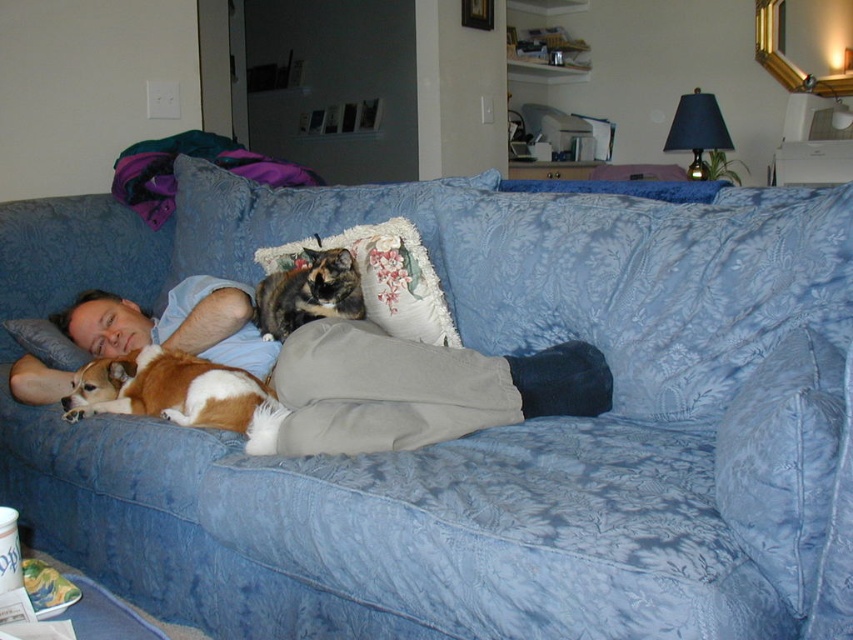
Question: Is blue floral fabric couch at center in front of calico fur cat at center?

Choices:
 (A) yes
 (B) no

Answer: (A)

Question: Which object appears farthest from the camera in this image?

Choices:
 (A) light blue fabric pants at center
 (B) calico fur cat at center

Answer: (B)

Question: Is floral fabric pillow at center positioned in front of calico fur cat at center?

Choices:
 (A) yes
 (B) no

Answer: (B)

Question: Where is light blue fabric pants at center located in relation to floral fabric pillow at center in the image?

Choices:
 (A) right
 (B) left

Answer: (A)

Question: Which object appears farthest from the camera in this image?

Choices:
 (A) floral fabric pillow at center
 (B) blue floral fabric couch at center

Answer: (A)

Question: Which of the following is the farthest from the observer?

Choices:
 (A) blue floral fabric couch at center
 (B) brown and white fur dog at lower left
 (C) light blue fabric pants at center

Answer: (B)